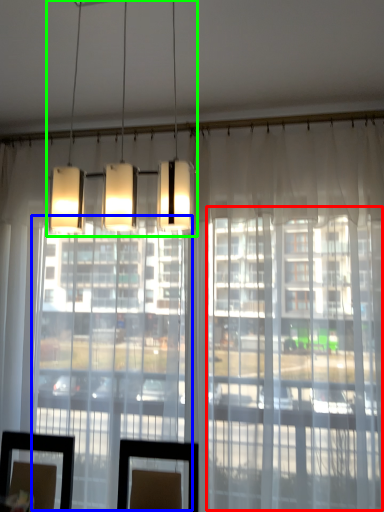
Question: Which is nearer to the glass door (highlighted by a red box)? glass door (highlighted by a blue box) or lamp (highlighted by a green box).

Choices:
 (A) glass door
 (B) lamp

Answer: (A)